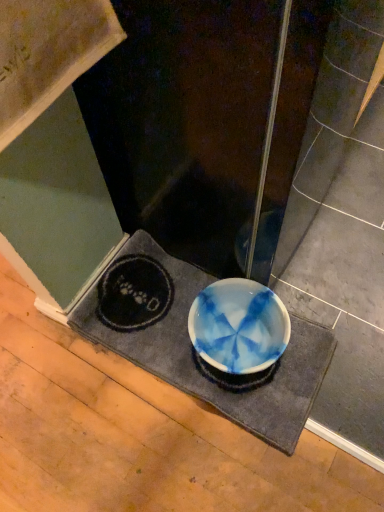
Identify the location of vacant space to the right of blue tie-dye fabric bath mat at center. (336, 297).